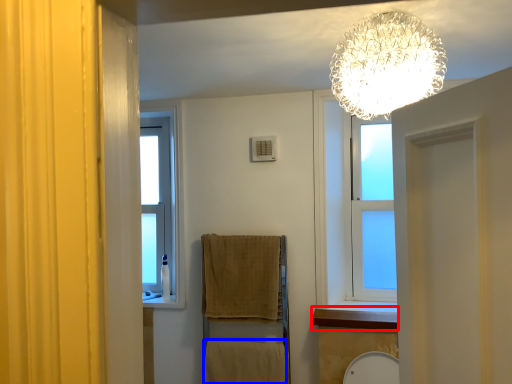
Question: Which of the following is the farthest to the observer, window sill (highlighted by a red box) or bath towel (highlighted by a blue box)?

Choices:
 (A) window sill
 (B) bath towel

Answer: (B)